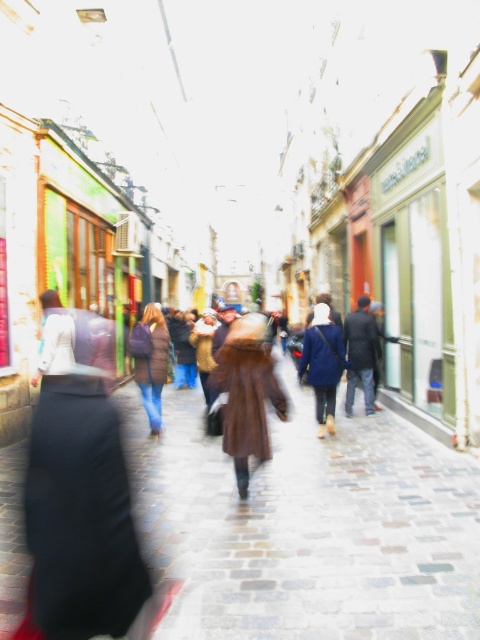
Is matte brown coat at center shorter than brown fuzzy coat at center?

In fact, matte brown coat at center may be taller than brown fuzzy coat at center.

Between point (319, 429) and point (137, 346), which one is positioned behind?

Point (319, 429)

Is point (310, 376) less distant than point (156, 314)?

Yes, it is in front of point (156, 314).

Locate an element on the screen. Image resolution: width=480 pixels, height=640 pixels. matte brown coat at center is located at coordinates (323, 364).

Identify the location of brown leather coat at center. Image resolution: width=480 pixels, height=640 pixels. (248, 394).

Is brown leather coat at center in front of matte brown coat at center?

Yes.

Identify the location of brown leather coat at center. (248, 394).

Who is positioned more to the left, brown leather coat at center or dark blue jeans at center?

brown leather coat at center is more to the left.

Can you confirm if brown leather coat at center is taller than dark blue jeans at center?

No.

Image resolution: width=480 pixels, height=640 pixels. Describe the element at coordinates (248, 394) in the screenshot. I see `brown leather coat at center` at that location.

Identify the location of brown leather coat at center. The height and width of the screenshot is (640, 480). (248, 394).